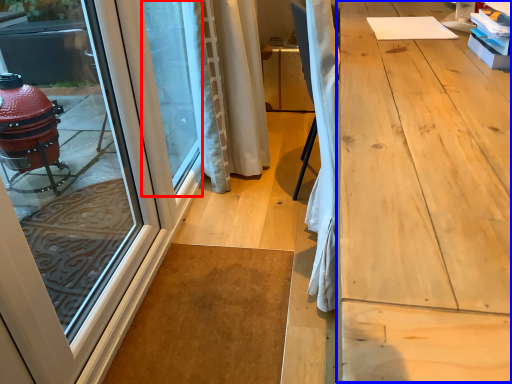
Question: Which point is closer to the camera, window screen (highlighted by a red box) or workbench (highlighted by a blue box)?

Choices:
 (A) window screen
 (B) workbench

Answer: (B)